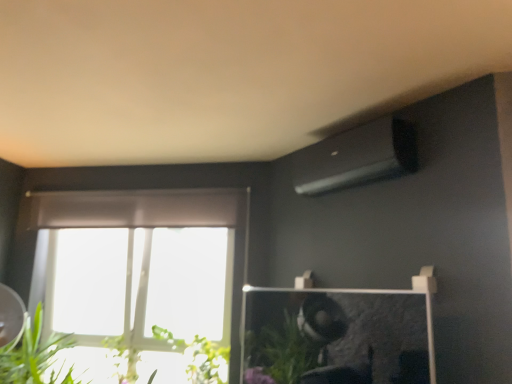
Question: Based on their sizes in the image, would you say green leafy plant at lower left, which ranks as the first plant in left-to-right order, is bigger or smaller than green leafy plant at lower left, placed as the 1th plant when sorted from right to left?

Choices:
 (A) small
 (B) big

Answer: (A)

Question: Does point coord(112,337) appear closer or farther from the camera than point coord(190,377)?

Choices:
 (A) farther
 (B) closer

Answer: (A)

Question: Estimate the real-world distances between objects in this image. Which object is closer to the green leafy plant at lower left, which ranks as the first plant in left-to-right order?

Choices:
 (A) green leafy plant at lower left
 (B) green leafy plant at lower left, the second plant viewed from the left

Answer: (B)

Question: Considering the real-world distances, which object is farthest from the green leafy plant at lower left, which ranks as the first plant in left-to-right order?

Choices:
 (A) green leafy plant at lower left, the second plant viewed from the left
 (B) green leafy plant at lower left

Answer: (B)